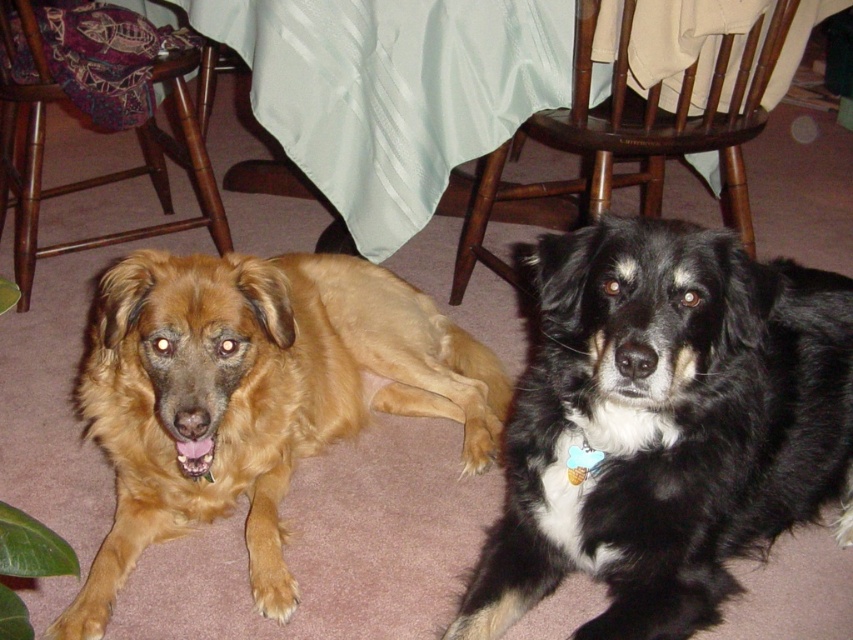
Question: Which object is the farthest from the black/white fur dog at center?

Choices:
 (A) bamboo chair at lower left
 (B) golden fur dog at left
 (C) wooden chair at center

Answer: (A)

Question: Can you confirm if wooden chair at center is bigger than bamboo chair at lower left?

Choices:
 (A) yes
 (B) no

Answer: (B)

Question: Does golden fur dog at left appear on the left side of bamboo chair at lower left?

Choices:
 (A) yes
 (B) no

Answer: (B)

Question: Which point is closer to the camera taking this photo?

Choices:
 (A) (708, 140)
 (B) (160, 196)
 (C) (480, 362)
 (D) (666, 442)

Answer: (D)

Question: Can you confirm if golden fur dog at left is positioned to the right of wooden chair at center?

Choices:
 (A) no
 (B) yes

Answer: (A)

Question: Which object is positioned farthest from the black/white fur dog at center?

Choices:
 (A) bamboo chair at lower left
 (B) golden fur dog at left
 (C) wooden chair at center

Answer: (A)